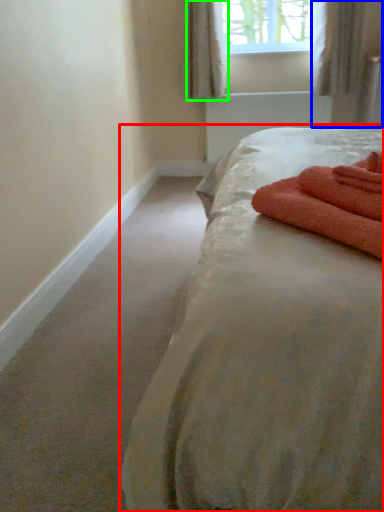
Question: Considering the real-world distances, which object is closest to bed (highlighted by a red box)? curtain (highlighted by a blue box) or curtain (highlighted by a green box).

Choices:
 (A) curtain
 (B) curtain

Answer: (A)